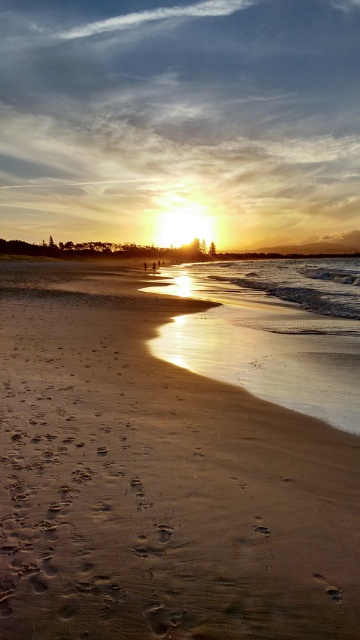
Question: Does sandy beach at lower left come in front of shiny wet sand at lower center?

Choices:
 (A) yes
 (B) no

Answer: (A)

Question: Which point is closer to the camera?

Choices:
 (A) sandy beach at lower left
 (B) shiny wet sand at lower center

Answer: (A)

Question: Where is sandy beach at lower left located in relation to shiny wet sand at lower center in the image?

Choices:
 (A) right
 (B) left

Answer: (B)

Question: Among these objects, which one is nearest to the camera?

Choices:
 (A) shiny wet sand at lower center
 (B) sandy beach at lower left

Answer: (B)

Question: Which of the following is the farthest from the observer?

Choices:
 (A) (241, 513)
 (B) (300, 285)

Answer: (B)

Question: Is sandy beach at lower left thinner than shiny wet sand at lower center?

Choices:
 (A) yes
 (B) no

Answer: (A)